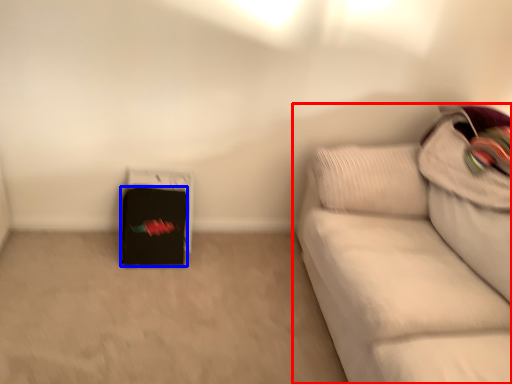
Question: Which of the following is the closest to the observer, studio couch (highlighted by a red box) or luggage (highlighted by a blue box)?

Choices:
 (A) studio couch
 (B) luggage

Answer: (A)